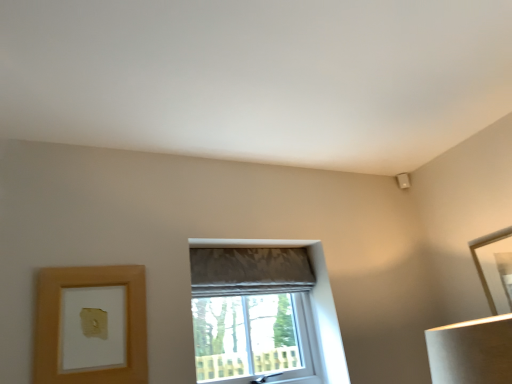
Question: Is matte gray fabric window at center inside or outside of gold metallic picture frame at upper right, placed as the 1th picture frame when sorted from back to front?

Choices:
 (A) outside
 (B) inside

Answer: (A)

Question: From a real-world perspective, is matte gray fabric window at center above or below gold metallic picture frame at upper right, which is the 2th picture frame from front to back?

Choices:
 (A) above
 (B) below

Answer: (B)

Question: Which of these objects is positioned farthest from the wooden picture frame at lower left, which is the first picture frame in front-to-back order?

Choices:
 (A) matte gray fabric window at center
 (B) matte gray curtain at center
 (C) gold metallic picture frame at upper right, the second picture frame viewed from the left

Answer: (C)

Question: Estimate the real-world distances between objects in this image. Which object is closer to the matte gray curtain at center?

Choices:
 (A) gold metallic picture frame at upper right, acting as the first picture frame starting from the right
 (B) matte gray fabric window at center
 (C) wooden picture frame at lower left, positioned as the 1th picture frame in left-to-right order

Answer: (B)